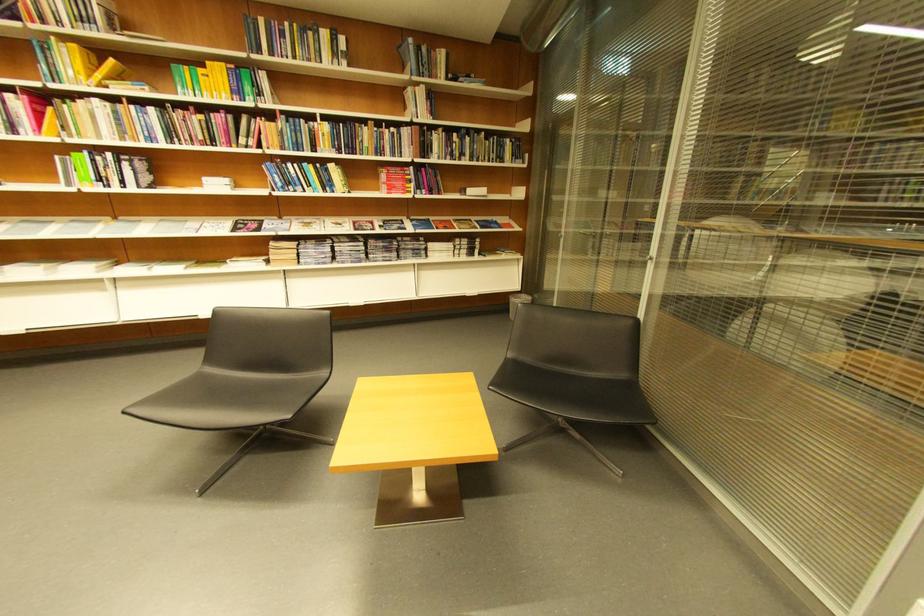
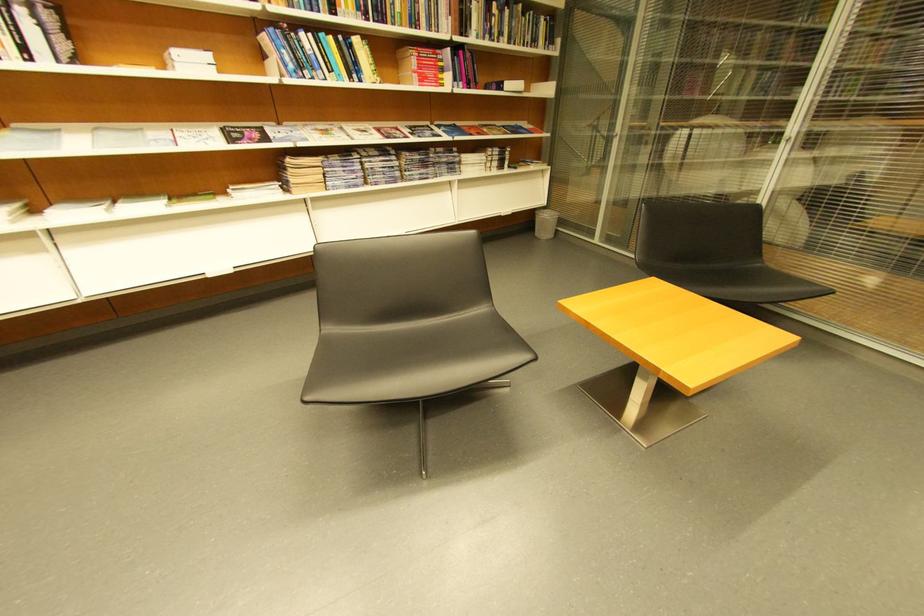
Looking at this image, what movement of the cameraman would produce the second image?

The cameraman moved toward left, forward.